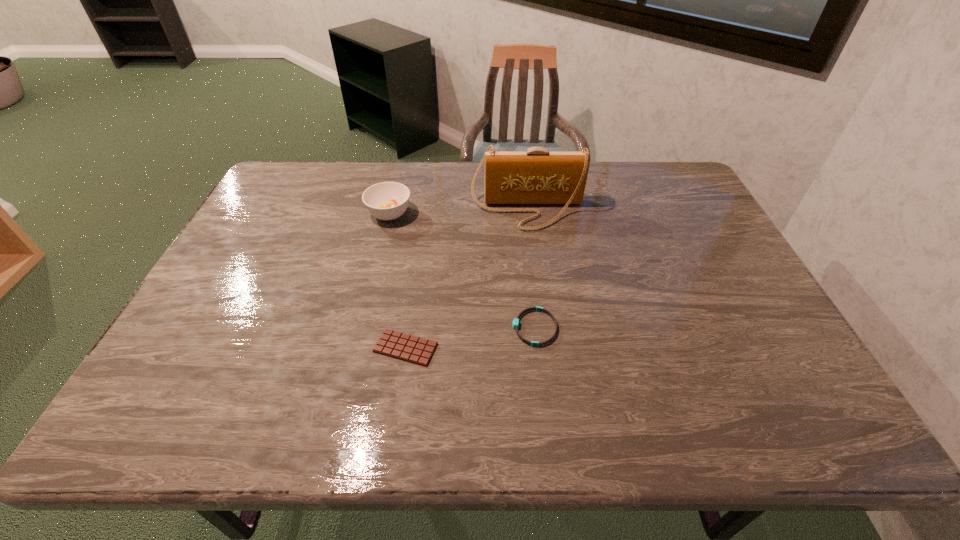
You are a GUI agent. You are given a task and a screenshot of the screen. Output one action in this format:
    pyautogui.click(x=<x>, y=<y>)
    Task: Click on the unoccupied position between the handbag and the candy bar
    The image size is (960, 540).
    Given the screenshot: What is the action you would take?
    pyautogui.click(x=467, y=279)

Locate an element on the screen. This screenshot has height=540, width=960. empty location between the candy bar and the tallest object is located at coordinates (467, 279).

Where is `vacant area that lies between the candy bar and the soup bowl`? vacant area that lies between the candy bar and the soup bowl is located at coordinates (397, 281).

Locate an element on the screen. The image size is (960, 540). free space between the candy bar and the soup bowl is located at coordinates (397, 281).

The height and width of the screenshot is (540, 960). I want to click on free point between the handbag and the shortest object, so pos(467,279).

Where is `the closest object relative to the soup bowl`? the closest object relative to the soup bowl is located at coordinates 537,176.

Where is `object that is the second closest to the second tallest object`? The image size is (960, 540). object that is the second closest to the second tallest object is located at coordinates (395, 344).

Image resolution: width=960 pixels, height=540 pixels. In order to click on vacant point that satisfies the following two spatial constraints: 1. on the decorative side of the handbag; 2. on the buckle of the second shortest object in this screenshot , I will do `click(541, 328)`.

Identify the location of blank area in the image that satisfies the following two spatial constraints: 1. on the buckle of the wristband; 2. on the front side of the shortest object. (537, 348).

At what (x,y) coordinates should I click in order to perform the action: click on vacant space that satisfies the following two spatial constraints: 1. on the buckle of the second shortest object; 2. on the front side of the shortest object. Please return your answer as a coordinate pair (x, y). This screenshot has width=960, height=540. Looking at the image, I should click on (537, 348).